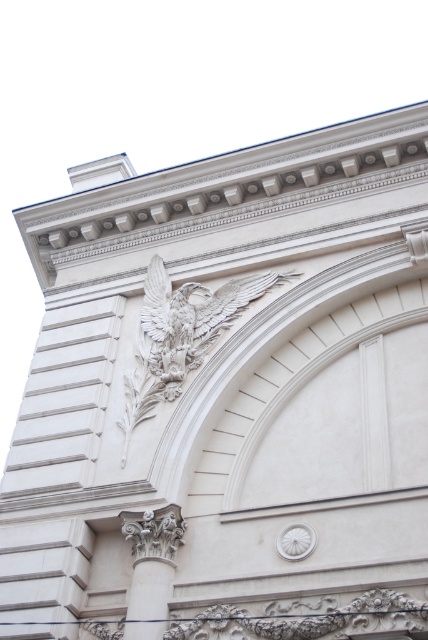
Question: Is white stone eagle at upper center to the right of white stone column at center from the viewer's perspective?

Choices:
 (A) no
 (B) yes

Answer: (B)

Question: Does white stone eagle at upper center have a lesser width compared to white stone column at center?

Choices:
 (A) yes
 (B) no

Answer: (B)

Question: Which of the following is the farthest from the observer?

Choices:
 (A) (148, 628)
 (B) (190, 364)

Answer: (B)

Question: Which object is closer to the camera taking this photo?

Choices:
 (A) white stone column at center
 (B) white stone eagle at upper center

Answer: (A)

Question: Is white stone eagle at upper center above white stone column at center?

Choices:
 (A) no
 (B) yes

Answer: (B)

Question: Among these points, which one is farthest from the camera?

Choices:
 (A) (133, 372)
 (B) (125, 512)

Answer: (A)